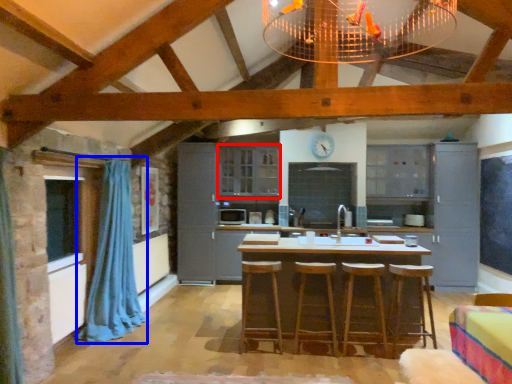
Question: Among these objects, which one is nearest to the camera, cabinetry (highlighted by a red box) or curtain (highlighted by a blue box)?

Choices:
 (A) cabinetry
 (B) curtain

Answer: (B)